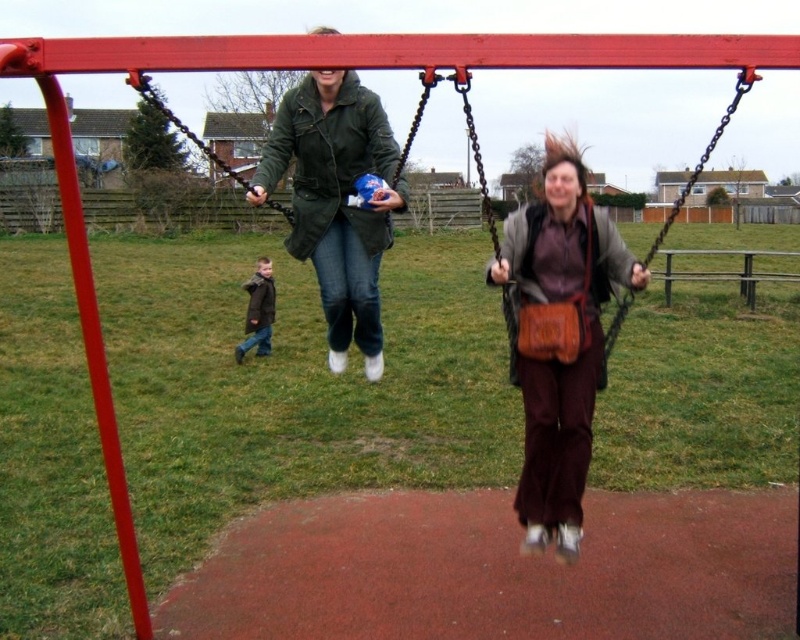
Question: Considering the relative positions of brown leather purse at center and green matte jacket at upper center in the image provided, where is brown leather purse at center located with respect to green matte jacket at upper center?

Choices:
 (A) right
 (B) left

Answer: (A)

Question: Is brown leather purse at center behind green matte jacket at center?

Choices:
 (A) yes
 (B) no

Answer: (B)

Question: Which object appears farthest from the camera in this image?

Choices:
 (A) green matte jacket at upper center
 (B) dark brown leather jacket at lower left

Answer: (B)

Question: Is brown leather purse at center wider than green matte jacket at upper center?

Choices:
 (A) yes
 (B) no

Answer: (B)

Question: Estimate the real-world distances between objects in this image. Which object is closer to the green matte jacket at center?

Choices:
 (A) brown leather purse at center
 (B) brown leather bag at center
 (C) green matte jacket at upper center

Answer: (A)

Question: Which point is farther to the camera?

Choices:
 (A) (380, 145)
 (B) (752, 68)

Answer: (A)